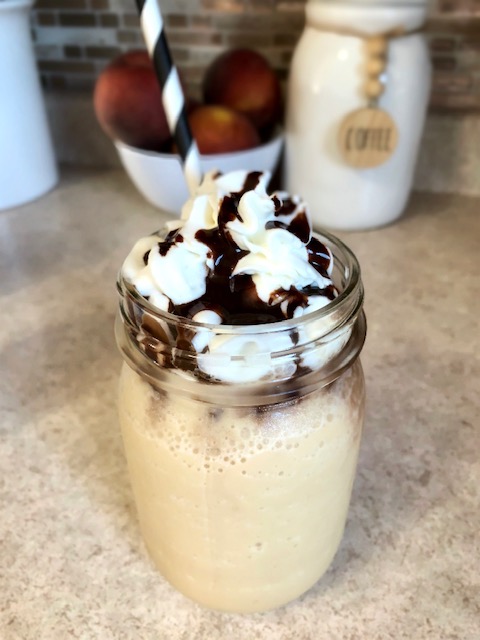
Find the location of `countertop`. countertop is located at coordinates (69, 332).